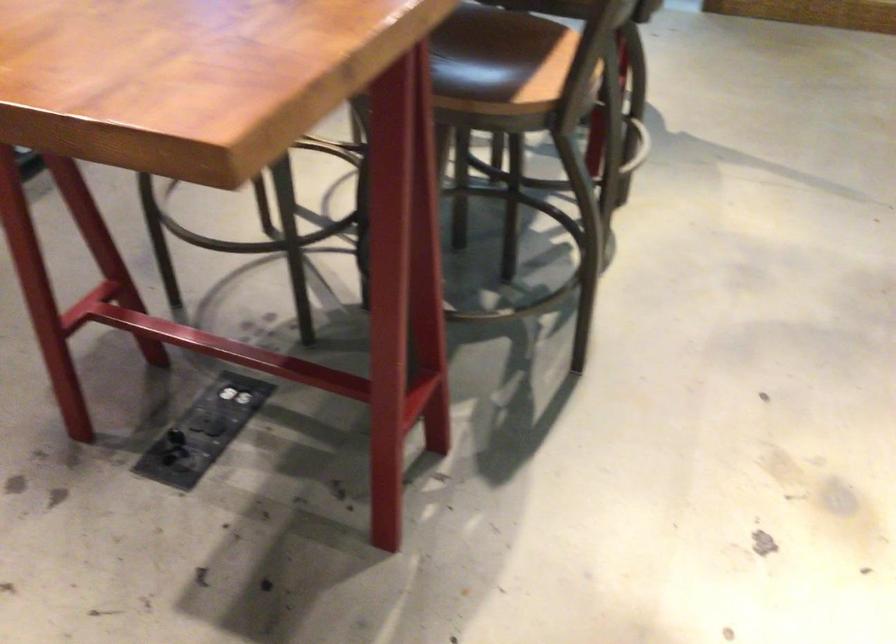
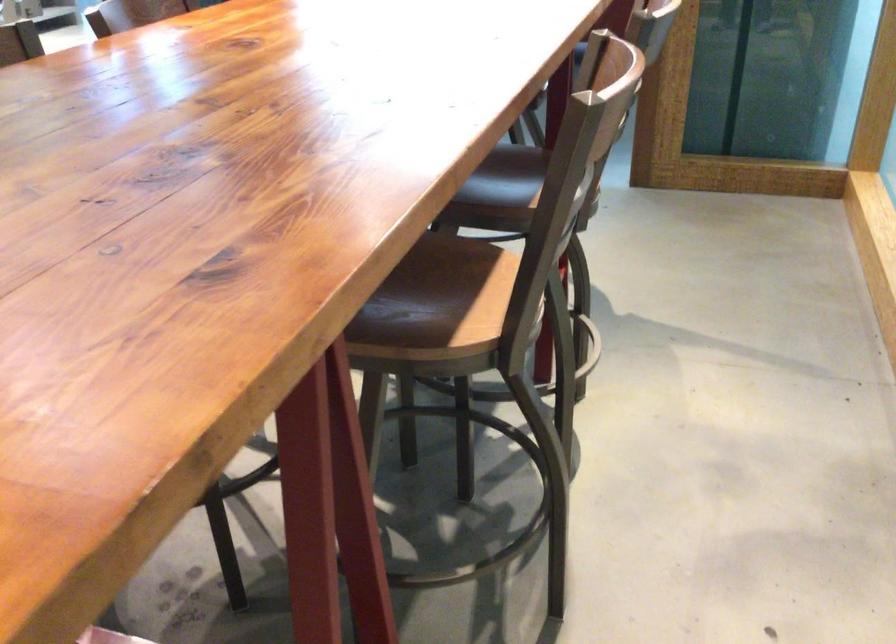
Question: Based on the continuous images, in which direction is the camera rotating? Reply with the corresponding letter.

Choices:
 (A) Left
 (B) Right
 (C) Up
 (D) Down

Answer: (C)